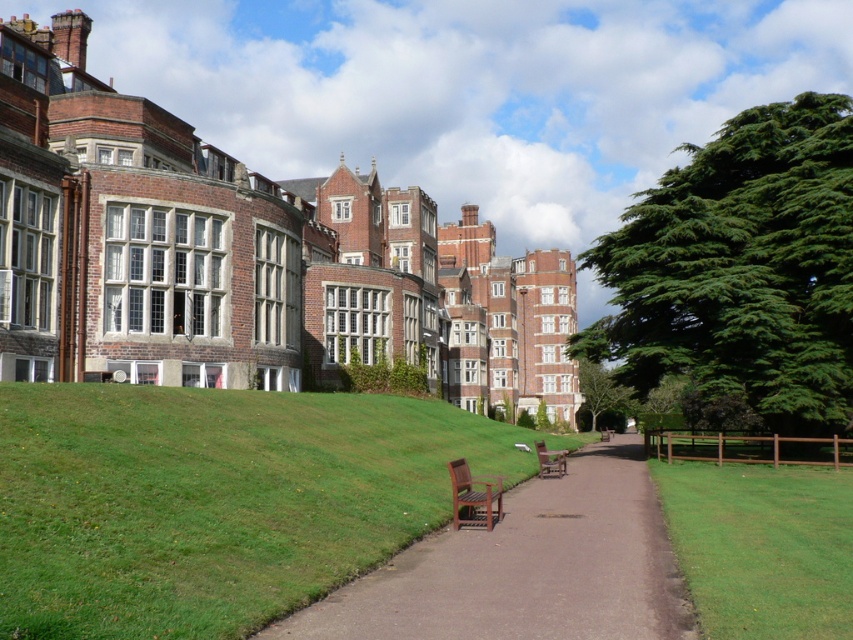
Which is more to the left, green grass at lower left or wooden park bench at center?

From the viewer's perspective, green grass at lower left appears more on the left side.

Does green grass at lower left have a larger size compared to wooden park bench at center?

Indeed, green grass at lower left has a larger size compared to wooden park bench at center.

Between point (62, 424) and point (548, 458), which one is positioned behind?

Positioned behind is point (548, 458).

This screenshot has width=853, height=640. I want to click on green grass at lower left, so click(216, 500).

The width and height of the screenshot is (853, 640). What do you see at coordinates (216, 500) in the screenshot? I see `green grass at lower left` at bounding box center [216, 500].

Does green grass at lower left appear over brown wooden bench at center?

Yes, green grass at lower left is above brown wooden bench at center.

Does point (206, 612) come closer to viewer compared to point (491, 588)?

That is True.

You are a GUI agent. You are given a task and a screenshot of the screen. Output one action in this format:
    pyautogui.click(x=<x>, y=<y>)
    Task: Click on the green grass at lower left
    This screenshot has height=640, width=853.
    Given the screenshot: What is the action you would take?
    pyautogui.click(x=216, y=500)

Is green grass at lower left to the left of teak wood bench at center from the viewer's perspective?

Correct, you'll find green grass at lower left to the left of teak wood bench at center.

Which is behind, point (219, 561) or point (486, 483)?

Point (486, 483)

This screenshot has height=640, width=853. Find the location of `green grass at lower left`. green grass at lower left is located at coordinates (216, 500).